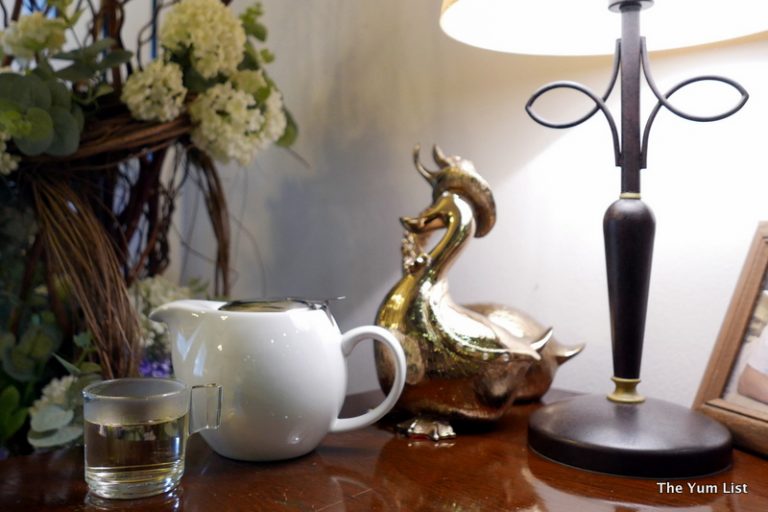
Find the location of a particular element. lamp shade is located at coordinates (696, 19).